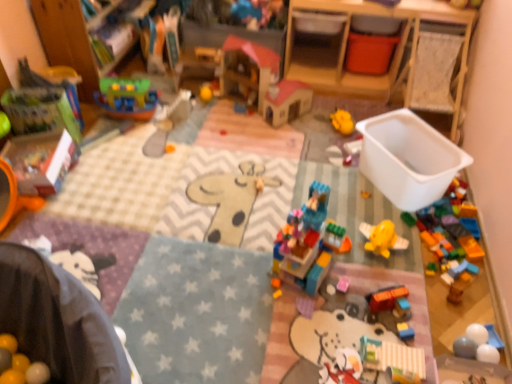
Question: Which direction should I rotate to face yellow rubber duck at center, which appears as the fifth toy when ordered from the bottom, — up or down?

Choices:
 (A) up
 (B) down

Answer: (A)

Question: Does translucent plastic airplane at center, which appears as the seventh toy when viewed from the top, have a lesser width compared to yellow matte ball at center, acting as the 3th toy starting from the top?

Choices:
 (A) yes
 (B) no

Answer: (A)

Question: Does translucent plastic airplane at center, placed as the fourth toy when sorted from bottom to top, have a lesser height compared to yellow matte ball at center, acting as the 3th toy starting from the top?

Choices:
 (A) yes
 (B) no

Answer: (A)

Question: From a real-world perspective, is translucent plastic airplane at center, which appears as the seventh toy when viewed from the top, over yellow matte ball at center, acting as the 3th toy starting from the top?

Choices:
 (A) no
 (B) yes

Answer: (A)

Question: Can you confirm if translucent plastic airplane at center, which appears as the seventh toy when viewed from the top, is taller than yellow matte ball at center, acting as the 3th toy starting from the top?

Choices:
 (A) yes
 (B) no

Answer: (B)

Question: Does translucent plastic airplane at center, placed as the fourth toy when sorted from bottom to top, come behind yellow matte ball at center, acting as the 3th toy starting from the top?

Choices:
 (A) no
 (B) yes

Answer: (A)

Question: Is translucent plastic airplane at center, placed as the fourth toy when sorted from bottom to top, not near yellow matte ball at center, acting as the 3th toy starting from the top?

Choices:
 (A) yes
 (B) no

Answer: (A)

Question: Does wooden toy at upper left come behind translucent plastic airplane at center, which appears as the seventh toy when viewed from the top?

Choices:
 (A) no
 (B) yes

Answer: (B)

Question: Is wooden toy at upper left wider than translucent plastic airplane at center, which appears as the seventh toy when viewed from the top?

Choices:
 (A) yes
 (B) no

Answer: (A)

Question: Is wooden toy at upper left closer to the viewer compared to translucent plastic airplane at center, which appears as the seventh toy when viewed from the top?

Choices:
 (A) yes
 (B) no

Answer: (B)

Question: Can you confirm if wooden toy at upper left is shorter than translucent plastic airplane at center, which appears as the seventh toy when viewed from the top?

Choices:
 (A) no
 (B) yes

Answer: (A)

Question: Is wooden toy at upper left to the right of translucent plastic airplane at center, placed as the fourth toy when sorted from bottom to top, from the viewer's perspective?

Choices:
 (A) no
 (B) yes

Answer: (A)

Question: Can you confirm if wooden toy at upper left is bigger than translucent plastic airplane at center, which appears as the seventh toy when viewed from the top?

Choices:
 (A) no
 (B) yes

Answer: (B)

Question: Can you confirm if wooden dollhouse at center, which is counted as the 9th toy, starting from the bottom, is bigger than translucent plastic airplane at center, which appears as the seventh toy when viewed from the top?

Choices:
 (A) no
 (B) yes

Answer: (B)